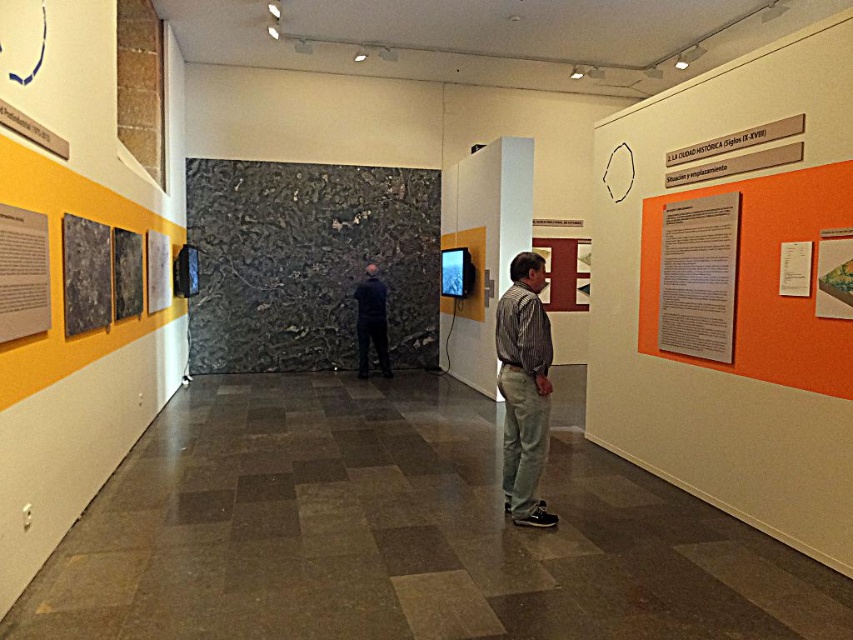
You are standing in the exhibition space and want to move from the left wall to the right wall. There are two points marked in the room, point A at coordinates point A is point (358, 204) and point B is point (520, 394). Which point should you avoid stepping on if you need to walk directly towards the right wall without crossing any restricted areas?

You should avoid stepping on point B because point A is behind point B, so walking towards the right wall would require passing behind point B, making it a restricted area to avoid.

You are an event planner setting up a small table in the exhibition space. The table is 2 meters wide and needs to be placed between the white paper at right and the dark blue fabric at center. Is there enough space to fit the table between them?

The white paper at right and the dark blue fabric at center are 5.27 meters apart, so yes, the table which is 2 meters wide can fit between them since the distance between the objects is greater than the table width.

You are an interior designer observing the exhibition space. You need to hang a new decorative item between the black textured wall at center and the striped cotton shirt at center. Based on their positions, where should you place the new item?

The black textured wall at center is located above the striped cotton shirt at center, so you should place the new decorative item between them either below the black textured wall at center and above the striped cotton shirt at center to maintain the vertical arrangement.